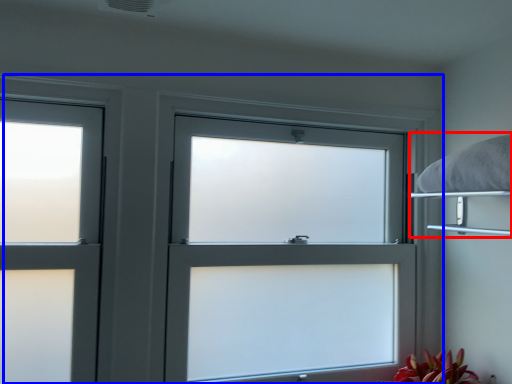
Question: Which point is closer to the camera, bed (highlighted by a red box) or window (highlighted by a blue box)?

Choices:
 (A) bed
 (B) window

Answer: (A)